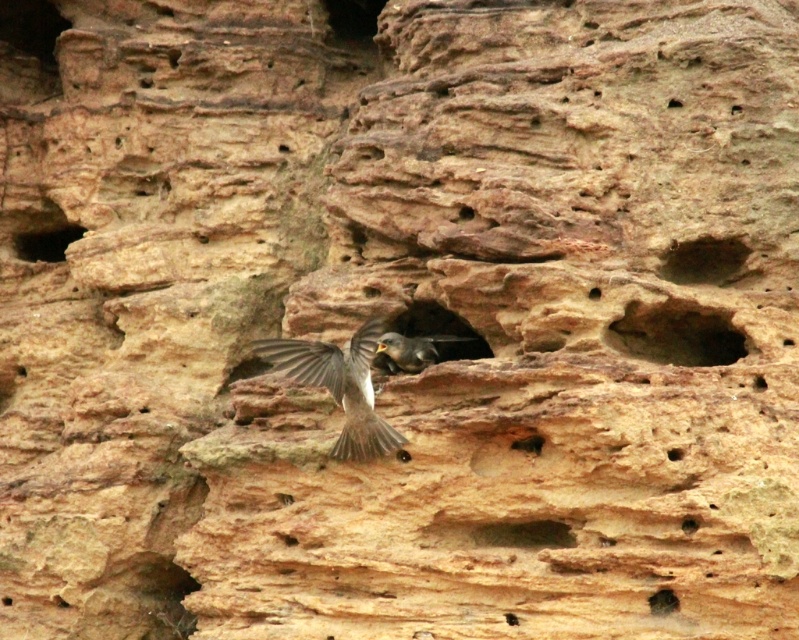
You are a bird looking for a nesting spot. You see the smooth rock hole at upper right and the smooth brown rock at center. Which one is positioned to the right side of the other?

The smooth rock hole at upper right is to the right of the smooth brown rock at center.

You are a bird with a wingspan of 20 cm. You want to enter the smooth rock hole at upper left and the smooth dark brown hole at lower right. Which hole can you fit into based on their sizes?

The smooth rock hole at upper left has a smaller width than the smooth dark brown hole at lower right. Since your wingspan is 20 cm, you can only fit into the smooth dark brown hole at lower right which is wider.